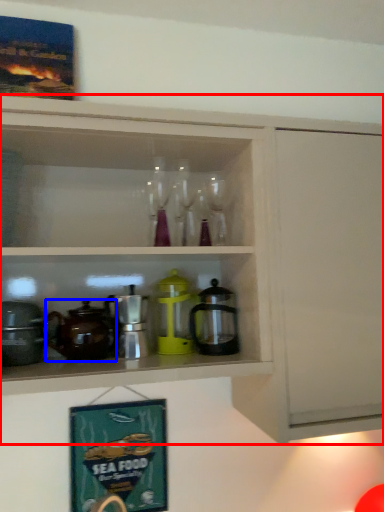
Question: Which of the following is the farthest to the observer, cabinetry (highlighted by a red box) or coffeepot (highlighted by a blue box)?

Choices:
 (A) cabinetry
 (B) coffeepot

Answer: (B)